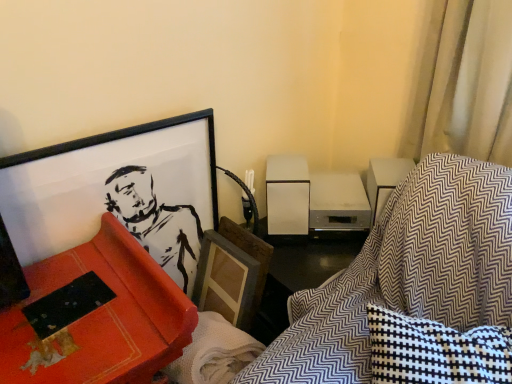
Question: From a real-world perspective, is matte red bookshelf at left above or below matte black picture frame at upper left?

Choices:
 (A) below
 (B) above

Answer: (A)

Question: Based on their sizes in the image, would you say matte red bookshelf at left is bigger or smaller than matte black picture frame at upper left?

Choices:
 (A) small
 (B) big

Answer: (B)

Question: Which object is the farthest from the matte red bookshelf at left?

Choices:
 (A) textured fabric swivel chair at lower right
 (B) matte black picture frame at upper left

Answer: (A)

Question: Estimate the real-world distances between objects in this image. Which object is closer to the textured fabric swivel chair at lower right?

Choices:
 (A) matte red bookshelf at left
 (B) matte black picture frame at upper left

Answer: (A)